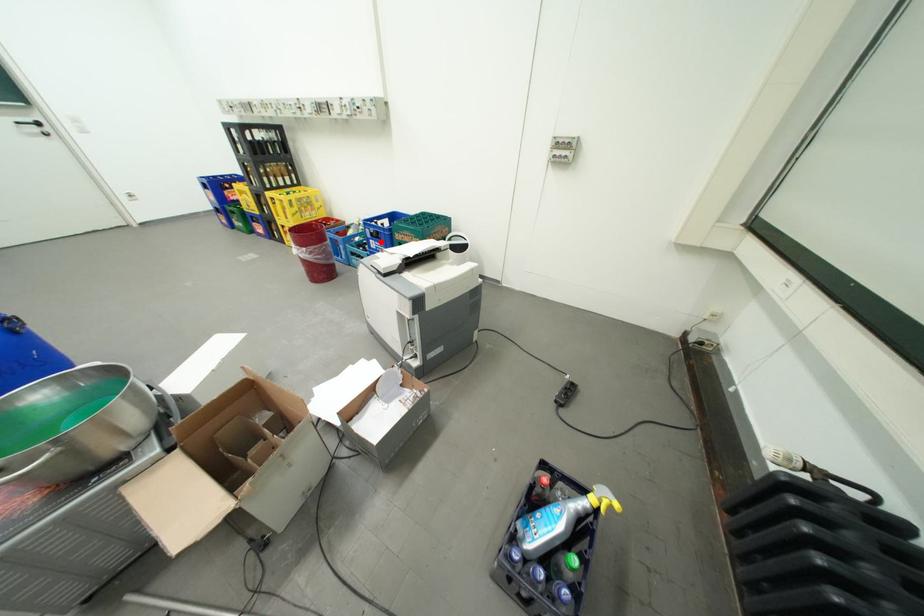
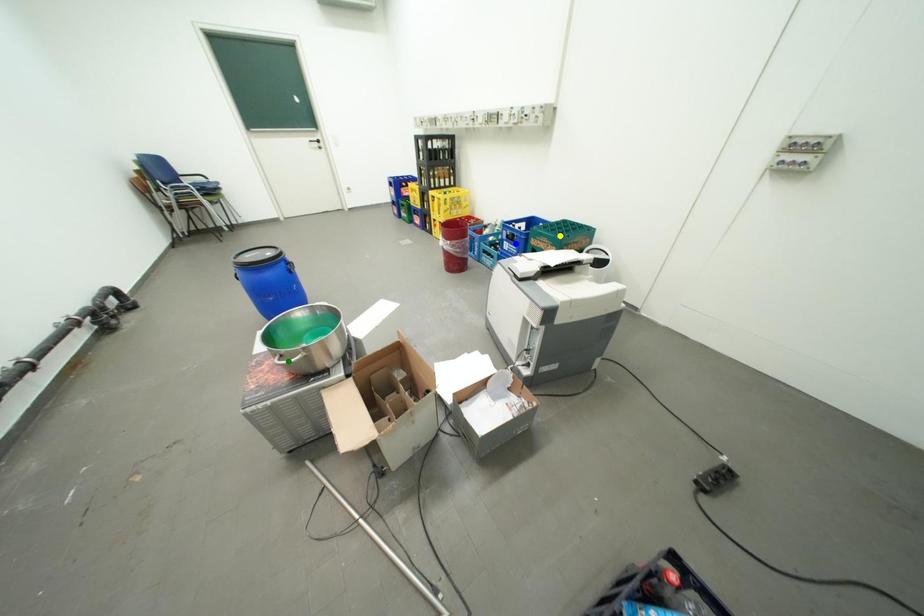
Question: I am providing you with two images of the same scene from different viewpoints. A red point is marked on the first image. You are given multiple points on the second image. In image 2, which mark is for the same physical point as the one in image 1?

Choices:
 (A) blue point
 (B) green point
 (C) yellow point

Answer: (A)